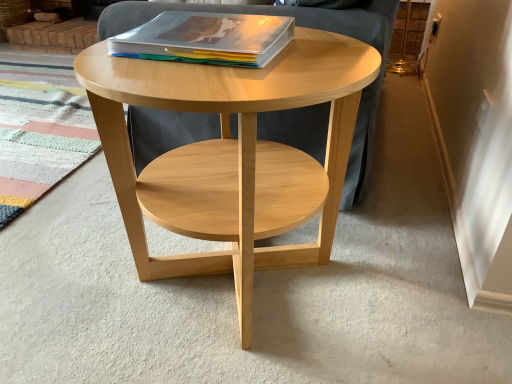
Question: Is natural wood coffee table at center in front of or behind matte plastic magazine at center in the image?

Choices:
 (A) front
 (B) behind

Answer: (A)

Question: From a real-world perspective, is natural wood coffee table at center above or below matte plastic magazine at center?

Choices:
 (A) below
 (B) above

Answer: (A)

Question: In terms of width, does natural wood coffee table at center look wider or thinner when compared to matte plastic magazine at center?

Choices:
 (A) wide
 (B) thin

Answer: (A)

Question: Considering their positions, is matte plastic magazine at center located in front of or behind natural wood coffee table at center?

Choices:
 (A) behind
 (B) front

Answer: (A)

Question: Is point (218, 23) positioned closer to the camera than point (296, 158)?

Choices:
 (A) closer
 (B) farther

Answer: (A)

Question: Based on their sizes in the image, would you say matte plastic magazine at center is bigger or smaller than natural wood coffee table at center?

Choices:
 (A) big
 (B) small

Answer: (B)

Question: Considering the positions of matte plastic magazine at center and natural wood coffee table at center in the image, is matte plastic magazine at center taller or shorter than natural wood coffee table at center?

Choices:
 (A) short
 (B) tall

Answer: (A)